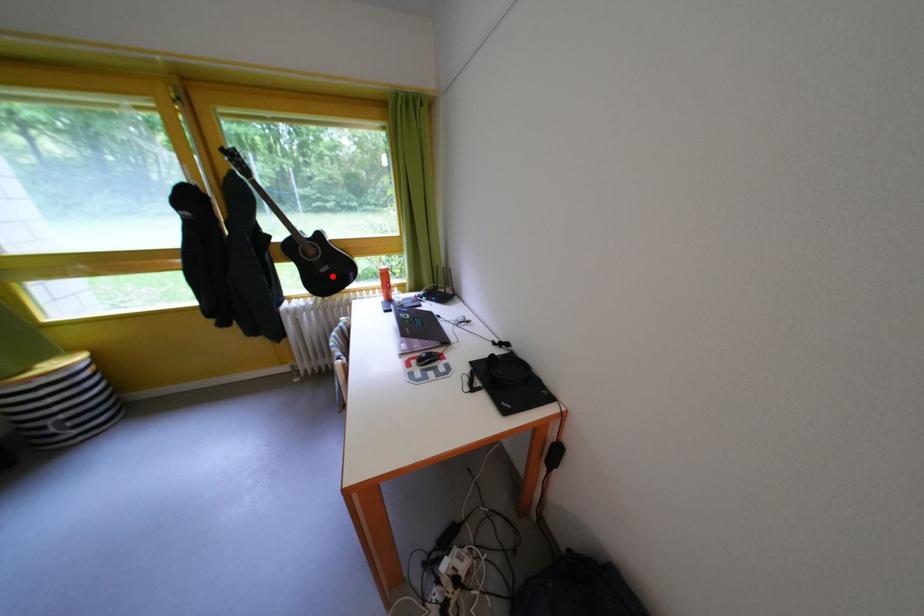
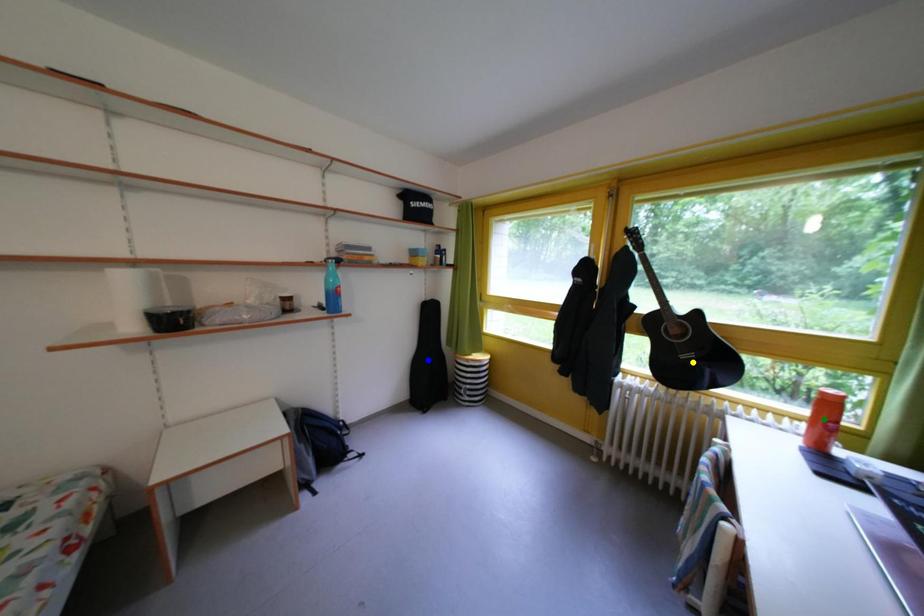
Question: I am providing you with two images of the same scene from different viewpoints. A red point is marked on the first image. You are given multiple points on the second image. In image 2, which mark is for the same physical point as the one in image 1?

Choices:
 (A) yellow point
 (B) blue point
 (C) green point

Answer: (A)